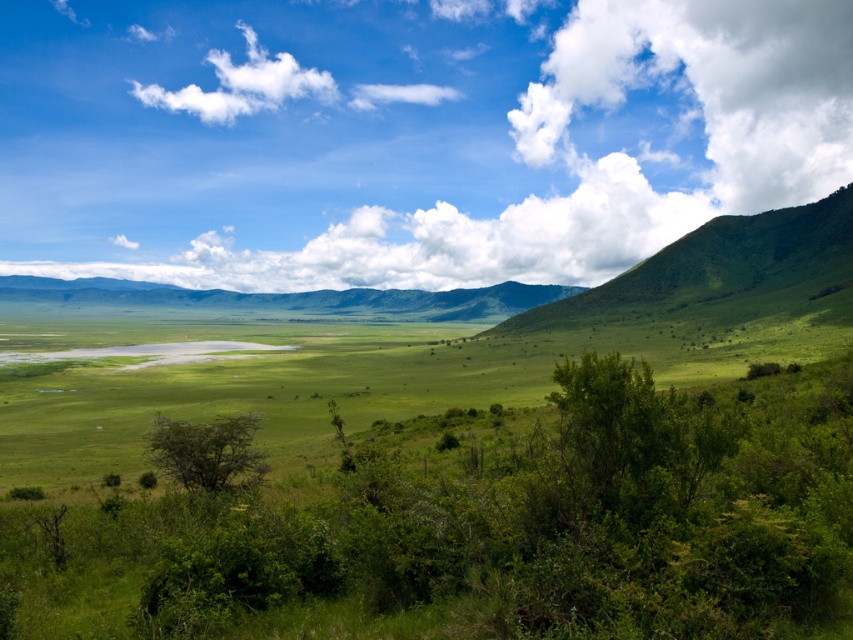
Question: Can you confirm if white fluffy cloud at upper center is smaller than green leafy shrubs at center?

Choices:
 (A) yes
 (B) no

Answer: (B)

Question: Which point is farther to the camera?

Choices:
 (A) white fluffy cloud at upper right
 (B) green leafy shrubs at center
 (C) white fluffy cloud at upper center

Answer: (A)

Question: Is green leafy shrubs at center smaller than white fluffy cloud at upper right?

Choices:
 (A) no
 (B) yes

Answer: (B)

Question: Which point appears closest to the camera in this image?

Choices:
 (A) (485, 264)
 (B) (834, 81)

Answer: (A)

Question: Which point is closer to the camera?

Choices:
 (A) green leafy shrubs at center
 (B) white fluffy cloud at upper center

Answer: (A)

Question: Does white fluffy cloud at upper center have a greater width compared to green leafy shrubs at center?

Choices:
 (A) yes
 (B) no

Answer: (A)